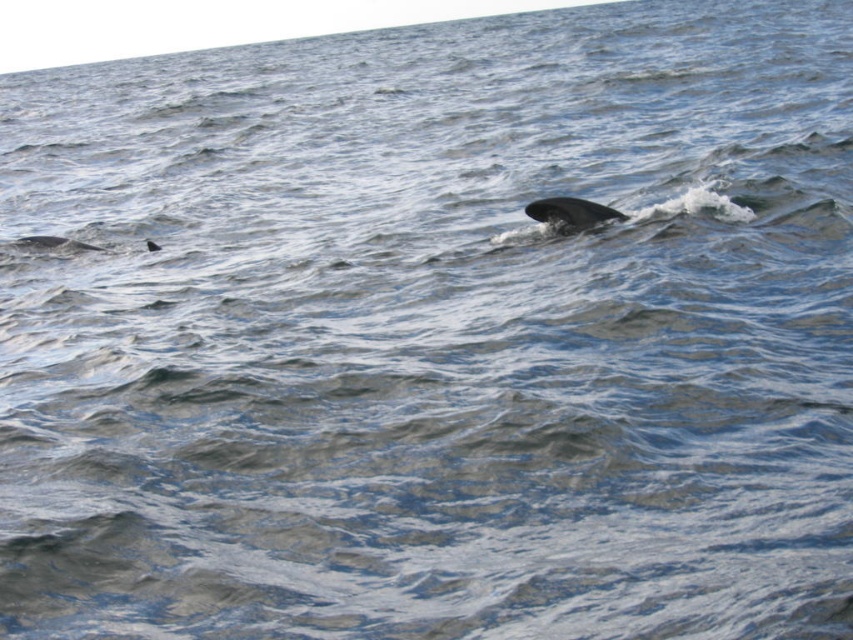
Looking at this image, you are a marine biologist observing two whales in the ocean. You notice a gray smooth whale at center and a gray matte whale at left. Which whale has a higher dorsal fin?

The gray smooth whale at center has a higher dorsal fin since it is taller than the gray matte whale at left.

You are a marine biologist observing two whales in the ocean. You notice the gray smooth whale at center and the gray matte whale at left. Which whale appears closer to you based on their positions in the water?

The gray smooth whale at center appears closer to you because it is positioned closer to the viewer compared to the gray matte whale at left.